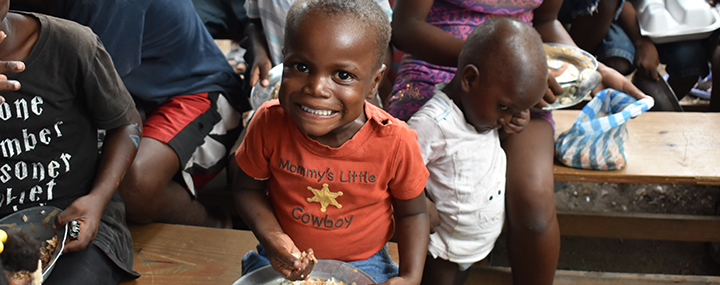
This screenshot has width=720, height=285. Find the location of `benches`. benches is located at coordinates (665, 146), (176, 253).